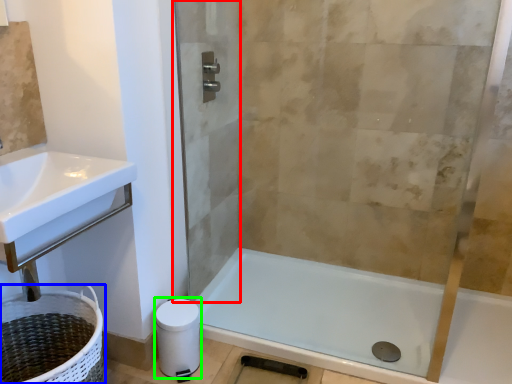
Question: Which object is positioned closest to screen door (highlighted by a red box)? Select from laundry basket (highlighted by a blue box) and toilet paper (highlighted by a green box).

Choices:
 (A) laundry basket
 (B) toilet paper

Answer: (B)